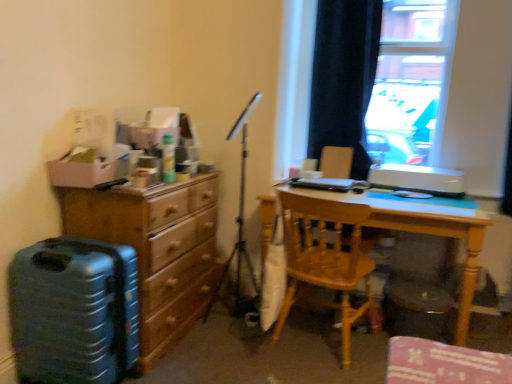
Find the location of `vacant space that's between wooden chest of drawers at left and metallic tripod at center`. vacant space that's between wooden chest of drawers at left and metallic tripod at center is located at coordinates (197, 351).